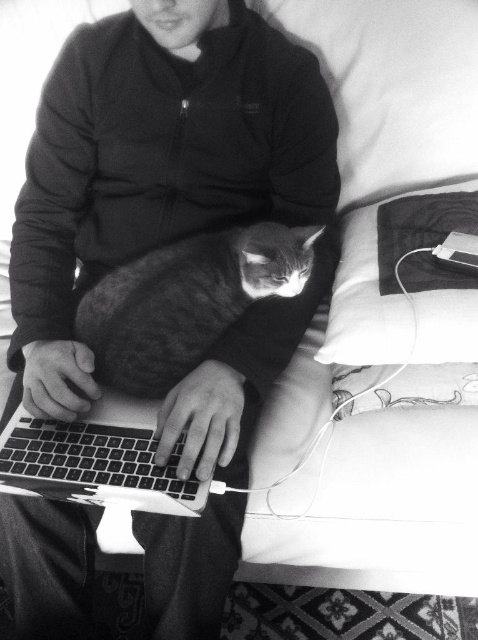
Question: Which object is positioned closest to the gray striped cat at center?

Choices:
 (A) soft fabric hoodie at center
 (B) white soft pillow at upper right

Answer: (A)

Question: Can you confirm if soft fabric hoodie at center is wider than soft fabric pillow at upper right?

Choices:
 (A) no
 (B) yes

Answer: (B)

Question: Which object is positioned closest to the soft fabric pillow at upper right?

Choices:
 (A) white soft pillow at upper right
 (B) metallic silver laptop at center
 (C) black matte keyboard at center

Answer: (A)

Question: Can you confirm if white soft pillow at upper right is wider than soft fabric pillow at upper right?

Choices:
 (A) yes
 (B) no

Answer: (A)

Question: Which is farther from the white soft pillow at upper right?

Choices:
 (A) metallic silver laptop at center
 (B) soft fabric hoodie at center
 (C) soft fabric pillow at upper right

Answer: (A)

Question: In this image, where is metallic silver laptop at center located relative to black matte keyboard at center?

Choices:
 (A) left
 (B) right

Answer: (B)